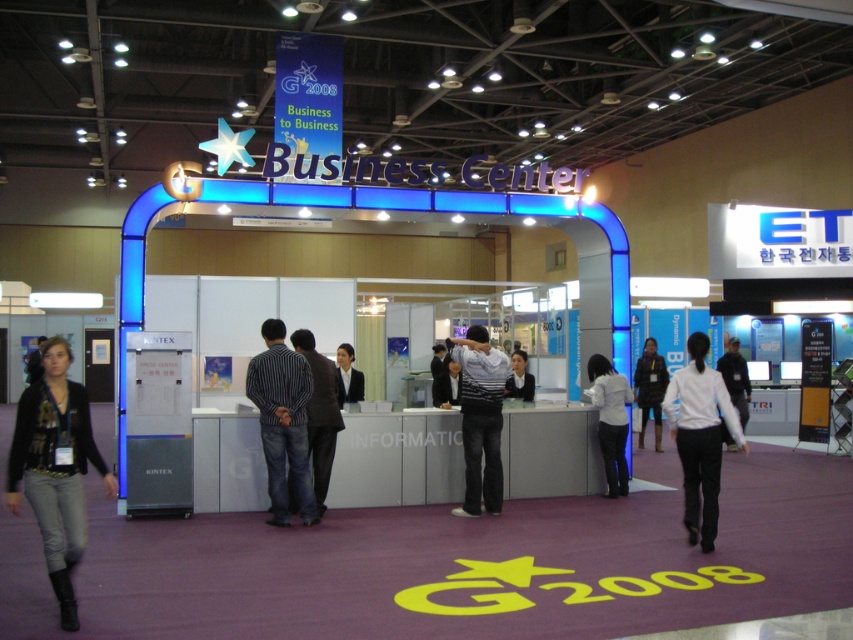
Question: Can you confirm if striped sweater at center is positioned to the left of dark brown leather jacket at center?

Choices:
 (A) yes
 (B) no

Answer: (A)

Question: Which of these objects is positioned farthest from the white matte shirt at center?

Choices:
 (A) denim jeans at lower left
 (B) white glossy shirt at center
 (C) dark blue jeans at center
 (D) striped cotton shirt at center

Answer: (A)

Question: Which point is farther from the camera taking this photo?

Choices:
 (A) (108, 477)
 (B) (329, 420)

Answer: (B)

Question: Among these objects, which one is nearest to the camera?

Choices:
 (A) striped sweater at center
 (B) dark gray suit at center
 (C) dark brown leather jacket at center

Answer: (A)

Question: Does denim jeans at lower left appear under striped sweater at center?

Choices:
 (A) no
 (B) yes

Answer: (A)

Question: Does white matte shirt at center have a larger size compared to striped cotton shirt at center?

Choices:
 (A) no
 (B) yes

Answer: (B)